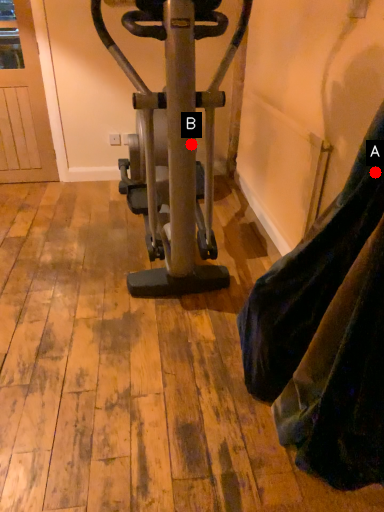
Question: Two points are circled on the image, labeled by A and B beside each circle. Which point is closer to the camera?

Choices:
 (A) A is closer
 (B) B is closer

Answer: (A)